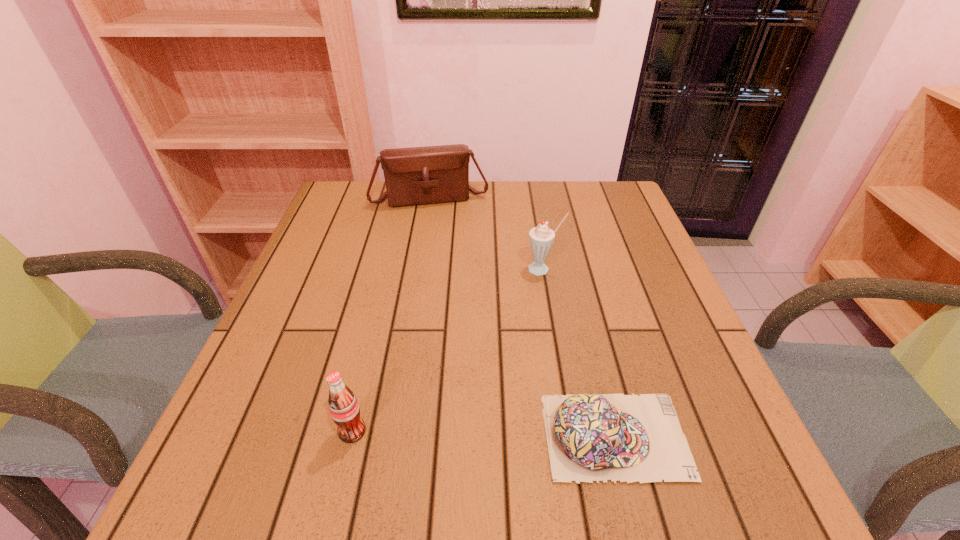
Where is `soda`? This screenshot has width=960, height=540. soda is located at coordinates (344, 409).

Identify the location of cap. The height and width of the screenshot is (540, 960). pos(591,437).

Locate an element on the screen. the third nearest object is located at coordinates (541, 238).

At what (x,y) coordinates should I click in order to perform the action: click on shoulder bag. Please return your answer as a coordinate pair (x, y). Looking at the image, I should click on (432, 174).

Locate an element on the screen. The image size is (960, 540). vacant space located 0.110m on the back of the soda is located at coordinates (368, 368).

In order to click on vacant space located 0.100m on the front, side, and top of the shortest object in this screenshot , I will do `click(744, 436)`.

You are a GUI agent. You are given a task and a screenshot of the screen. Output one action in this format:
    pyautogui.click(x=<x>, y=<y>)
    Task: Click on the vacant space located 0.250m on the straw side of the third nearest object
    Image resolution: width=960 pixels, height=540 pixels.
    Given the screenshot: What is the action you would take?
    pyautogui.click(x=501, y=352)

Where is `vacant space located on the straw side of the third nearest object`? The image size is (960, 540). vacant space located on the straw side of the third nearest object is located at coordinates (477, 400).

You are a GUI agent. You are given a task and a screenshot of the screen. Output one action in this format:
    pyautogui.click(x=<x>, y=<y>)
    Task: Click on the vacant space located 0.160m on the straw side of the third nearest object
    
    Given the screenshot: What is the action you would take?
    516,321

What are the coordinates of `blank space located 0.330m on the front flap of the farthest object` in the screenshot? It's located at (456, 285).